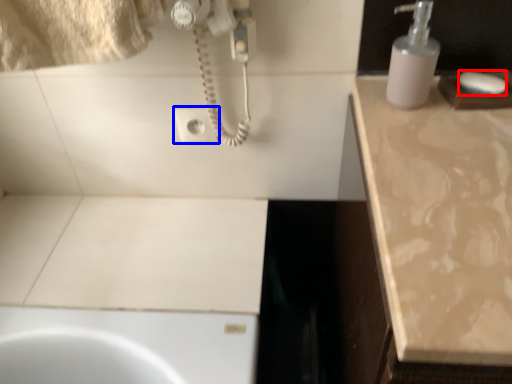
Question: Which object appears closest to the camera in this image, soap (highlighted by a red box) or electric outlet (highlighted by a blue box)?

Choices:
 (A) soap
 (B) electric outlet

Answer: (A)